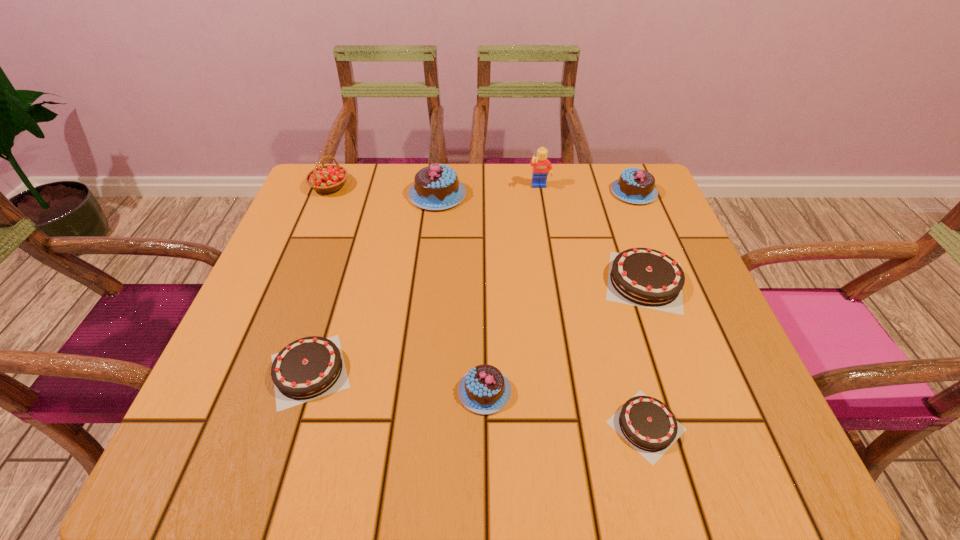
In the image, there is a desktop. Where is `vacant space at the left edge`? vacant space at the left edge is located at coordinates (272, 298).

At what (x,y) coordinates should I click in order to perform the action: click on vacant space at the right edge. Please return your answer as a coordinate pair (x, y). This screenshot has height=540, width=960. Looking at the image, I should click on (700, 282).

Where is `vacant space at the far left corner of the desktop`? Image resolution: width=960 pixels, height=540 pixels. vacant space at the far left corner of the desktop is located at coordinates (x=323, y=164).

Locate an element on the screen. This screenshot has height=540, width=960. vacant space at the far right corner is located at coordinates (597, 204).

This screenshot has width=960, height=540. In order to click on vacant space at the near right corner in this screenshot , I will do `click(726, 442)`.

Where is `vacant space that is in between the Lego and the nearest pink chocolate cake`? Image resolution: width=960 pixels, height=540 pixels. vacant space that is in between the Lego and the nearest pink chocolate cake is located at coordinates (513, 289).

The height and width of the screenshot is (540, 960). What are the coordinates of `vacant point located between the brown strawberry and the smallest pink chocolate cake` in the screenshot? It's located at pos(407,289).

Identify the location of free space between the tallest chocolate cake and the second biggest brown chocolate cake. (373, 283).

The height and width of the screenshot is (540, 960). In order to click on vacant area between the rightmost pink chocolate cake and the fifth tallest chocolate cake in this screenshot , I will do `click(471, 281)`.

The width and height of the screenshot is (960, 540). What are the coordinates of `vacant area that lies between the Lego and the leftmost chocolate cake` in the screenshot? It's located at (424, 279).